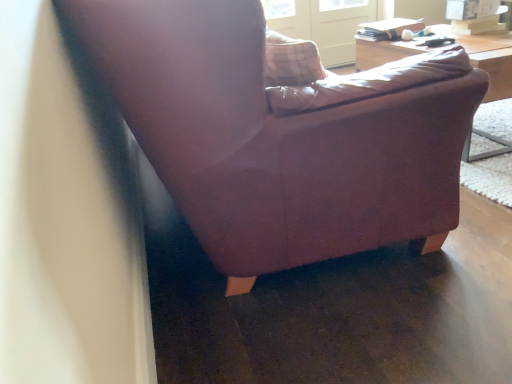
Question: From the image's perspective, is clear glass screen door at upper center over matte purple armchair at center?

Choices:
 (A) no
 (B) yes

Answer: (B)

Question: Considering the relative sizes of clear glass screen door at upper center and matte purple armchair at center in the image provided, is clear glass screen door at upper center bigger than matte purple armchair at center?

Choices:
 (A) yes
 (B) no

Answer: (B)

Question: Would you say matte purple armchair at center is part of clear glass screen door at upper center's contents?

Choices:
 (A) yes
 (B) no

Answer: (B)

Question: From the image's perspective, does clear glass screen door at upper center appear lower than matte purple armchair at center?

Choices:
 (A) no
 (B) yes

Answer: (A)

Question: Is clear glass screen door at upper center aimed at matte purple armchair at center?

Choices:
 (A) no
 (B) yes

Answer: (B)

Question: Can you confirm if clear glass screen door at upper center is smaller than matte purple armchair at center?

Choices:
 (A) yes
 (B) no

Answer: (A)

Question: Can you see wooden table at upper right touching matte purple armchair at center?

Choices:
 (A) no
 (B) yes

Answer: (A)

Question: Is matte purple armchair at center located within wooden table at upper right?

Choices:
 (A) no
 (B) yes

Answer: (A)

Question: From the image's perspective, would you say wooden table at upper right is positioned over matte purple armchair at center?

Choices:
 (A) no
 (B) yes

Answer: (B)

Question: Are wooden table at upper right and matte purple armchair at center located far from each other?

Choices:
 (A) no
 (B) yes

Answer: (B)

Question: From a real-world perspective, is wooden table at upper right positioned under matte purple armchair at center based on gravity?

Choices:
 (A) no
 (B) yes

Answer: (A)

Question: Is wooden table at upper right thinner than matte purple armchair at center?

Choices:
 (A) no
 (B) yes

Answer: (B)

Question: Does wooden table at upper right contain clear glass screen door at upper center?

Choices:
 (A) yes
 (B) no

Answer: (B)